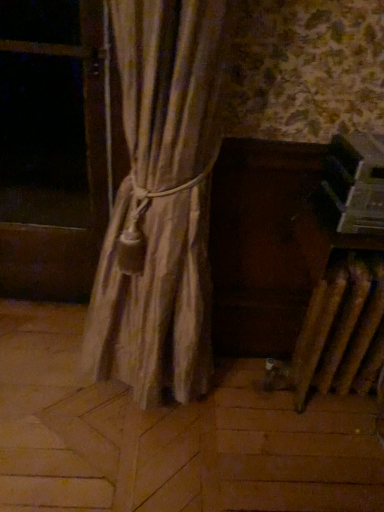
Question: From the image's perspective, is textured beige curtain at center under transparent plastic window screen at left?

Choices:
 (A) yes
 (B) no

Answer: (A)

Question: Is textured beige curtain at center taller than transparent plastic window screen at left?

Choices:
 (A) yes
 (B) no

Answer: (A)

Question: Does textured beige curtain at center lie behind transparent plastic window screen at left?

Choices:
 (A) yes
 (B) no

Answer: (B)

Question: Is textured beige curtain at center at the right side of transparent plastic window screen at left?

Choices:
 (A) yes
 (B) no

Answer: (A)

Question: Can we say textured beige curtain at center lies outside transparent plastic window screen at left?

Choices:
 (A) yes
 (B) no

Answer: (A)

Question: Does textured beige curtain at center have a lesser height compared to transparent plastic window screen at left?

Choices:
 (A) no
 (B) yes

Answer: (A)

Question: Is transparent plastic window screen at left wider than textured beige curtain at center?

Choices:
 (A) yes
 (B) no

Answer: (B)

Question: Can you confirm if transparent plastic window screen at left is taller than textured beige curtain at center?

Choices:
 (A) no
 (B) yes

Answer: (A)

Question: Is there a large distance between transparent plastic window screen at left and textured beige curtain at center?

Choices:
 (A) no
 (B) yes

Answer: (B)

Question: Would you say transparent plastic window screen at left is outside textured beige curtain at center?

Choices:
 (A) yes
 (B) no

Answer: (A)

Question: Considering the relative positions of transparent plastic window screen at left and textured beige curtain at center in the image provided, is transparent plastic window screen at left behind textured beige curtain at center?

Choices:
 (A) no
 (B) yes

Answer: (B)

Question: Is transparent plastic window screen at left to the left of textured beige curtain at center from the viewer's perspective?

Choices:
 (A) yes
 (B) no

Answer: (A)

Question: From their relative heights in the image, would you say transparent plastic window screen at left is taller or shorter than textured beige curtain at center?

Choices:
 (A) short
 (B) tall

Answer: (A)